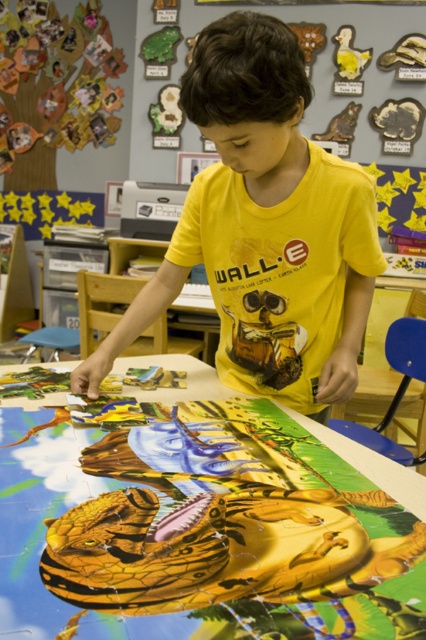
Question: Is wooden puzzle pieces at center to the left of yellow cotton shirt at center from the viewer's perspective?

Choices:
 (A) no
 (B) yes

Answer: (B)

Question: Observing the image, what is the correct spatial positioning of wooden puzzle pieces at center in reference to wooden animal figures at upper center?

Choices:
 (A) left
 (B) right

Answer: (A)

Question: Which of the following is the farthest from the observer?

Choices:
 (A) (373, 13)
 (B) (302, 220)

Answer: (A)

Question: Which object appears farthest from the camera in this image?

Choices:
 (A) yellow cotton shirt at center
 (B) wooden animal figures at upper center

Answer: (B)

Question: Based on their relative distances, which object is farther from the wooden animal figures at upper center?

Choices:
 (A) wooden puzzle pieces at center
 (B) yellow cotton shirt at center

Answer: (A)

Question: Is wooden puzzle pieces at center behind wooden animal figures at upper center?

Choices:
 (A) no
 (B) yes

Answer: (A)